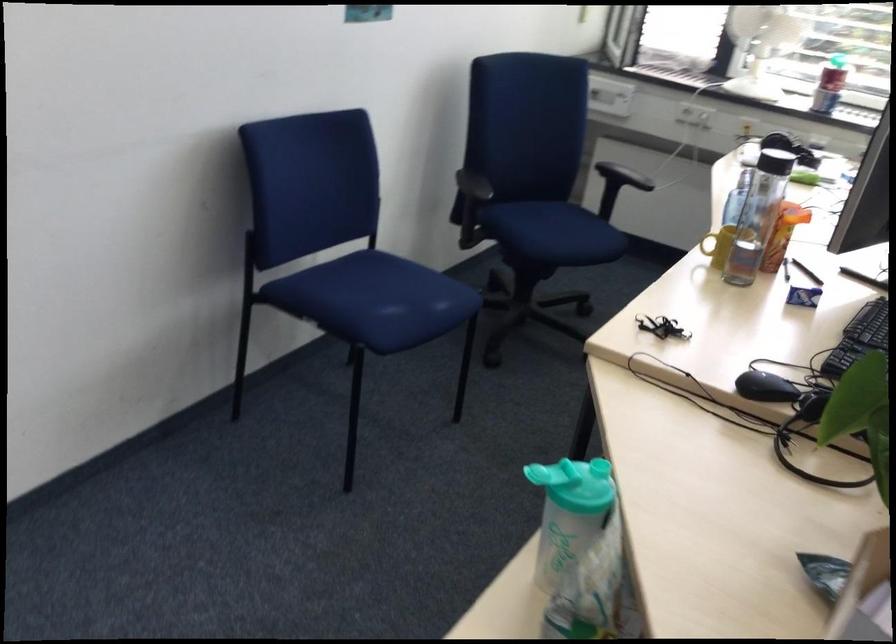
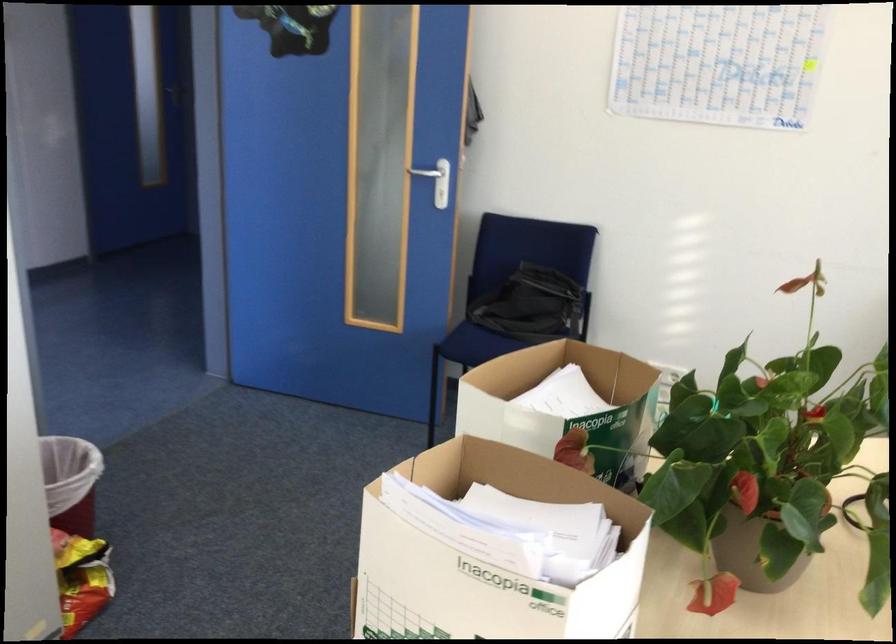
Question: I am providing you with two images of the same scene from different viewpoints. Please identify which objects are invisible in image2.

Choices:
 (A) white door handle
 (B) green bottle lid
 (C) red trash can
 (D) white control dial

Answer: (B)